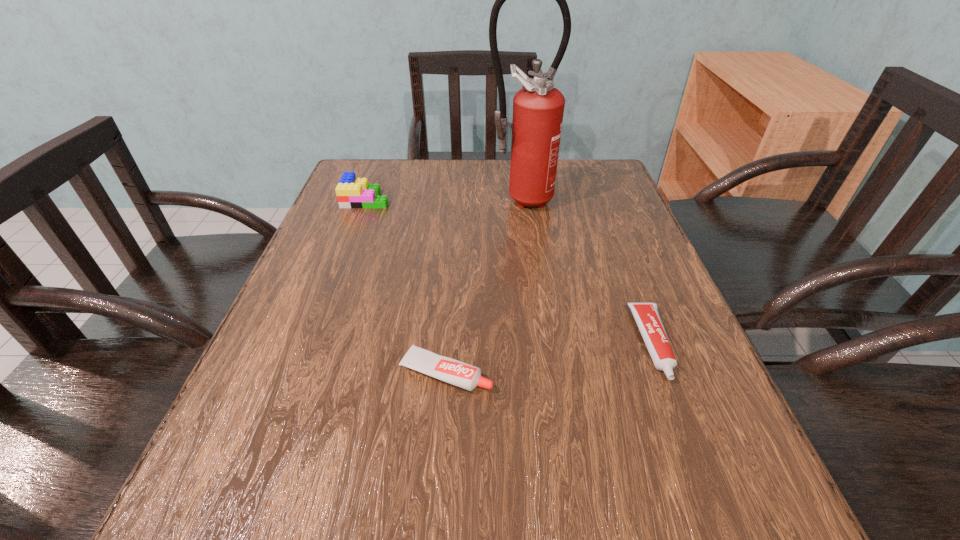
You are a GUI agent. You are given a task and a screenshot of the screen. Output one action in this format:
    pyautogui.click(x=<x>, y=<y>)
    Task: Click on the fire extinguisher
    
    Given the screenshot: What is the action you would take?
    pyautogui.click(x=538, y=108)

Find the location of a particular element. This screenshot has width=960, height=540. the leftmost object is located at coordinates (352, 192).

Where is `the second tallest object`? the second tallest object is located at coordinates click(352, 192).

Where is `the rightmost object`? the rightmost object is located at coordinates (646, 315).

Locate an element on the screen. the left toothpaste is located at coordinates (460, 374).

Where is `free point located at the nozzle of the fire extinguisher`? The width and height of the screenshot is (960, 540). free point located at the nozzle of the fire extinguisher is located at coordinates (528, 261).

This screenshot has height=540, width=960. I want to click on vacant space located on the back of the Lego, so click(x=381, y=159).

The image size is (960, 540). What are the coordinates of `vacant space located 0.090m at the nozzle of the rightmost object` in the screenshot? It's located at (688, 438).

At what (x,y) coordinates should I click in order to perform the action: click on free space located on the right of the left toothpaste. Please return your answer as a coordinate pair (x, y). Looking at the image, I should click on (673, 372).

Where is `fire extinguisher that is positioned at the far edge`? fire extinguisher that is positioned at the far edge is located at coordinates (538, 108).